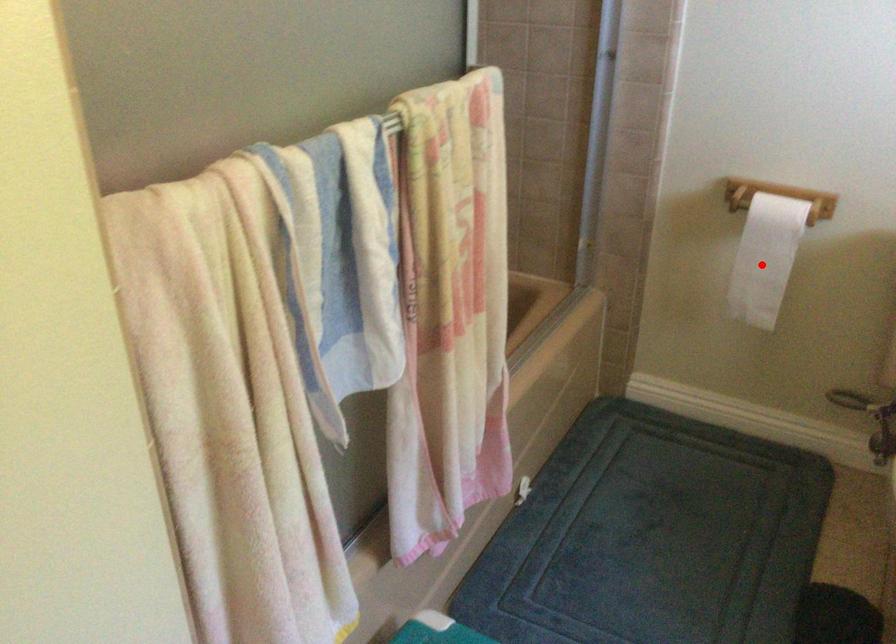
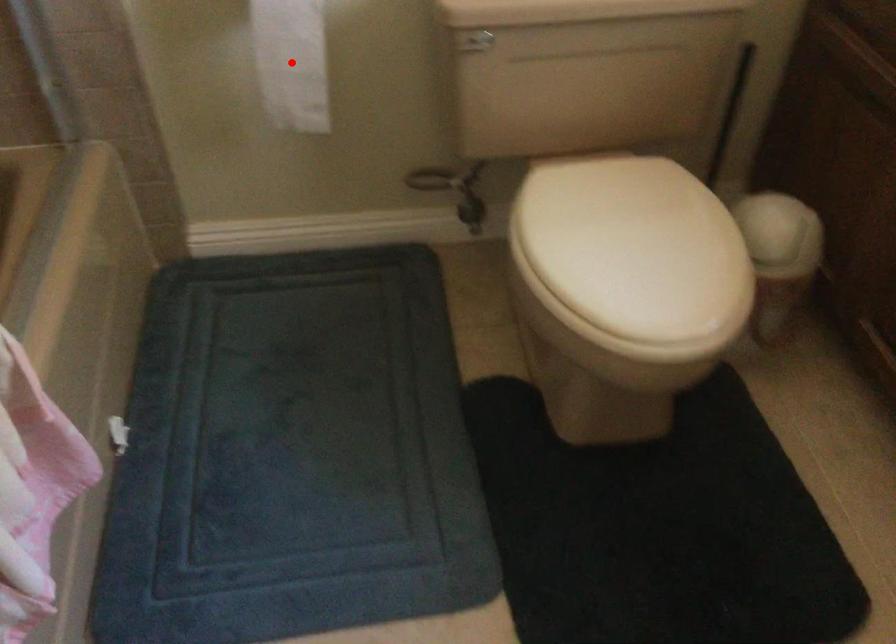
I am providing you with two images of the same scene from different viewpoints. A red point is marked on the first image and another point is marked on the second image. Do the highlighted points in image1 and image2 indicate the same real-world spot?

Yes